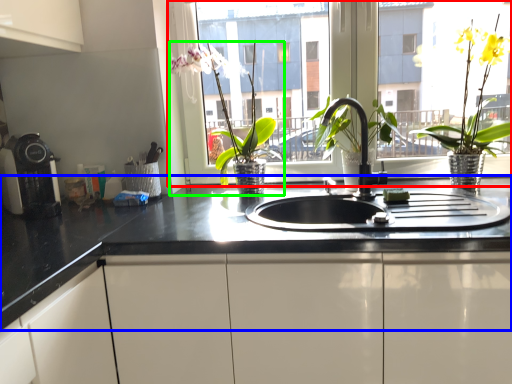
Question: Which is nearer to the window (highlighted by a red box)? countertop (highlighted by a blue box) or houseplant (highlighted by a green box).

Choices:
 (A) countertop
 (B) houseplant

Answer: (B)